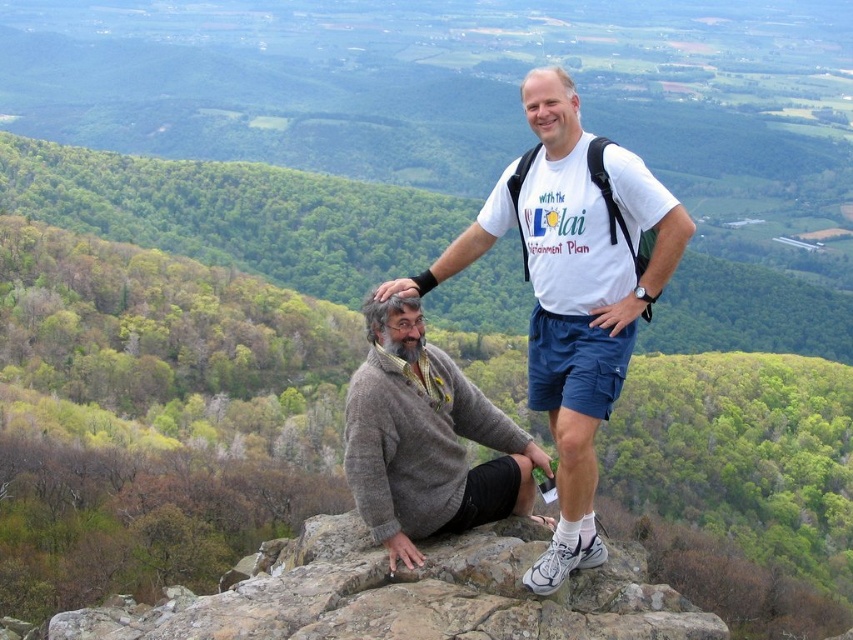
Does white t-shirt at center have a greater height compared to knitted sweater at center?

Indeed, white t-shirt at center has a greater height compared to knitted sweater at center.

Between point (395, 285) and point (404, 499), which one is positioned behind?

Positioned behind is point (395, 285).

Between point (584, 172) and point (426, 362), which one is positioned behind?

Positioned behind is point (426, 362).

Locate an element on the screen. white t-shirt at center is located at coordinates (572, 289).

Is rocky surface at center thinner than knitted sweater at center?

No, rocky surface at center is not thinner than knitted sweater at center.

Is rocky surface at center below knitted sweater at center?

Yes.

Which is in front, point (143, 612) or point (360, 483)?

Point (360, 483) is in front.

You are a GUI agent. You are given a task and a screenshot of the screen. Output one action in this format:
    pyautogui.click(x=<x>, y=<y>)
    Task: Click on the rocky surface at center
    Image resolution: width=853 pixels, height=640 pixels.
    Given the screenshot: What is the action you would take?
    pyautogui.click(x=405, y=595)

Between point (621, 291) and point (714, 627), which one is positioned in front?

Positioned in front is point (714, 627).

Who is more forward, (560, 147) or (204, 595)?

Positioned in front is point (560, 147).

Where is `white t-shirt at center`? The width and height of the screenshot is (853, 640). white t-shirt at center is located at coordinates (572, 289).